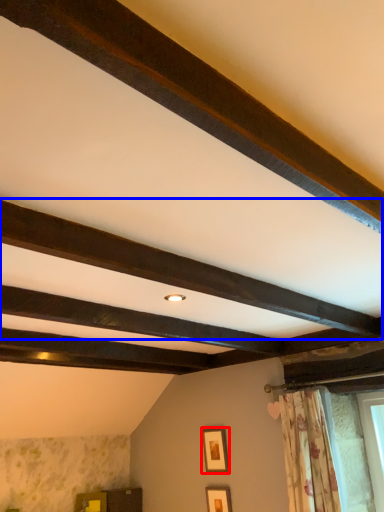
Question: Which object is closer to the camera taking this photo, picture frame (highlighted by a red box) or plank (highlighted by a blue box)?

Choices:
 (A) picture frame
 (B) plank

Answer: (B)